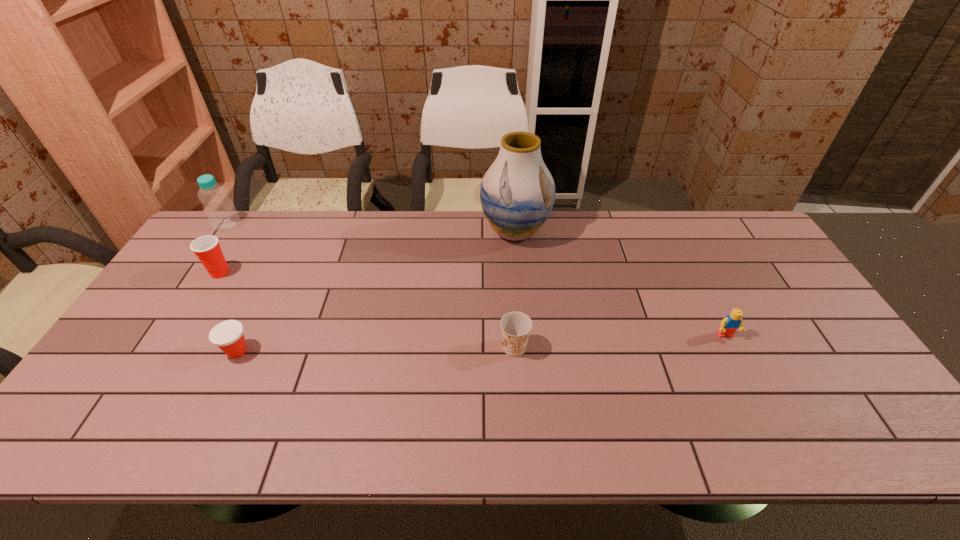
Where is `free space between the third farthest object and the vase`? The image size is (960, 540). free space between the third farthest object and the vase is located at coordinates (368, 252).

Image resolution: width=960 pixels, height=540 pixels. I want to click on vacant area that lies between the bottle and the fourth shortest object, so (x=224, y=249).

Locate an element on the screen. This screenshot has width=960, height=540. free space between the rightmost Dixie cup and the Lego is located at coordinates (620, 341).

In order to click on the fourth closest object to the tallest object in this screenshot , I will do `click(207, 248)`.

What are the coordinates of `object that is the fifth closest to the leftmost Dixie cup` in the screenshot? It's located at (733, 321).

Find the location of `the closest Dixie cup relative to the Lego`. the closest Dixie cup relative to the Lego is located at coordinates (515, 326).

Identify which Dixie cup is the nearest to the fourth nearest object. Please provide its 2D coordinates. Your answer should be formatted as a tuple, i.e. [(x, y)], where the tuple contains the x and y coordinates of a point satisfying the conditions above.

[(228, 335)]

Where is `blank space that satisfies the following two spatial constraints: 1. on the front side of the second tallest object; 2. on the left side of the tallest Dixie cup`? blank space that satisfies the following two spatial constraints: 1. on the front side of the second tallest object; 2. on the left side of the tallest Dixie cup is located at coordinates [196, 273].

Where is `vacant space that satisfies the following two spatial constraints: 1. on the front side of the fifth shortest object; 2. on the right side of the second Dixie cup from left to right`? The width and height of the screenshot is (960, 540). vacant space that satisfies the following two spatial constraints: 1. on the front side of the fifth shortest object; 2. on the right side of the second Dixie cup from left to right is located at coordinates (143, 351).

Find the location of a particular element. free region that satisfies the following two spatial constraints: 1. on the back side of the second tallest Dixie cup; 2. on the left side of the shortest Dixie cup is located at coordinates (239, 347).